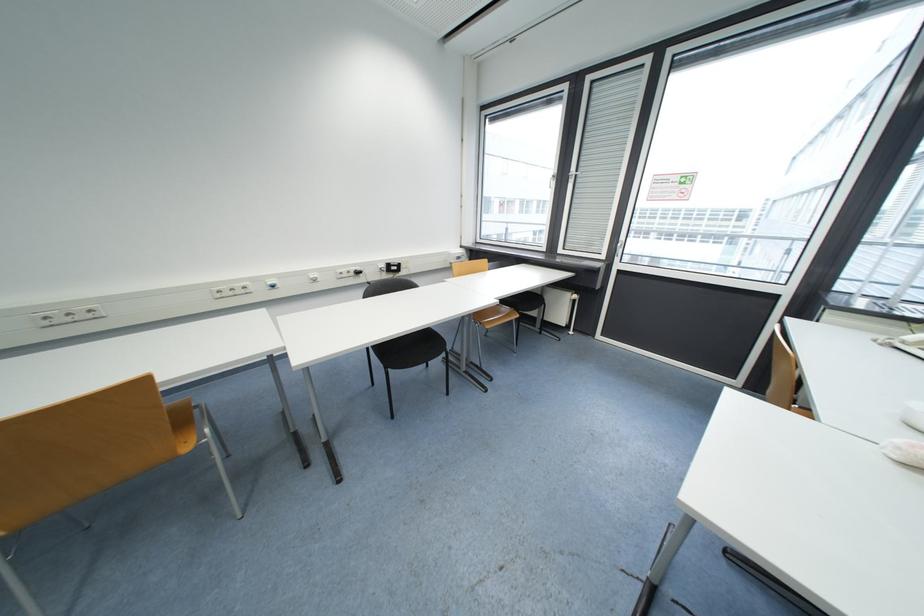
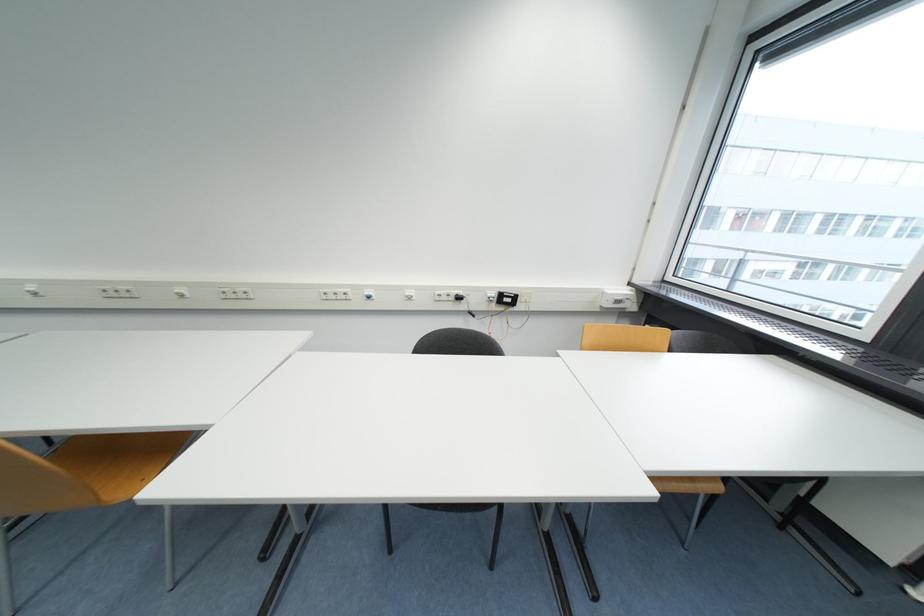
Question: Based on the continuous images, in which direction is the camera rotating? Reply with the corresponding letter.

Choices:
 (A) Left
 (B) Right
 (C) Up
 (D) Down

Answer: (A)